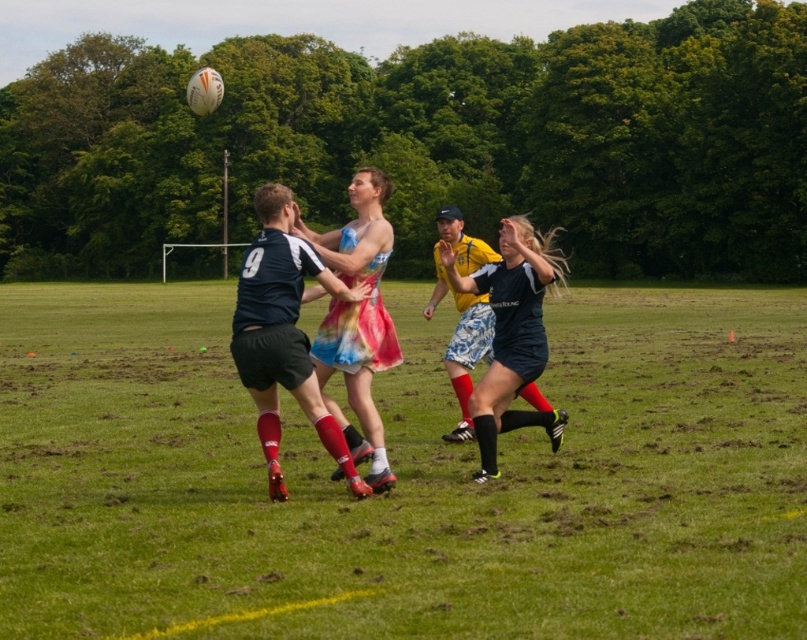
You are a rugby player standing on the field and see the green grass at center and the matte black shorts at center. Which object is closer to you?

The green grass at center is closer to you because it is in front of the matte black shorts at center.

You are a rugby player standing on the field. You need to place a 1 meter wide equipment box between the green grass at center and the matte black shorts at center. Is there enough space?

The green grass at center is wider than the matte black shorts at center. The combined width of both objects is not specified, so it is unclear if there is enough space to place the equipment box between them.